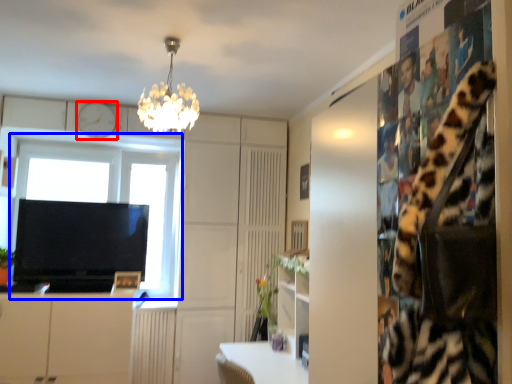
Question: Which of the following is the farthest to the observer, clock (highlighted by a red box) or window (highlighted by a blue box)?

Choices:
 (A) clock
 (B) window

Answer: (B)